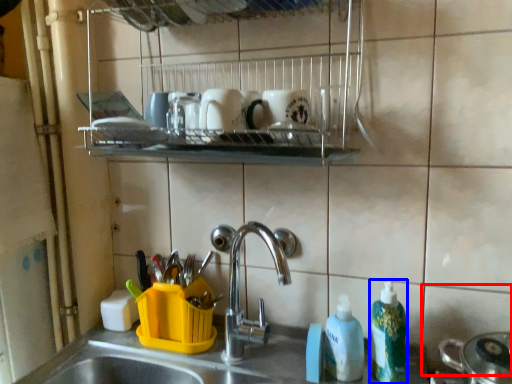
Question: Among these objects, which one is nearest to the camera, tile (highlighted by a red box) or cleaning product (highlighted by a blue box)?

Choices:
 (A) tile
 (B) cleaning product

Answer: (A)